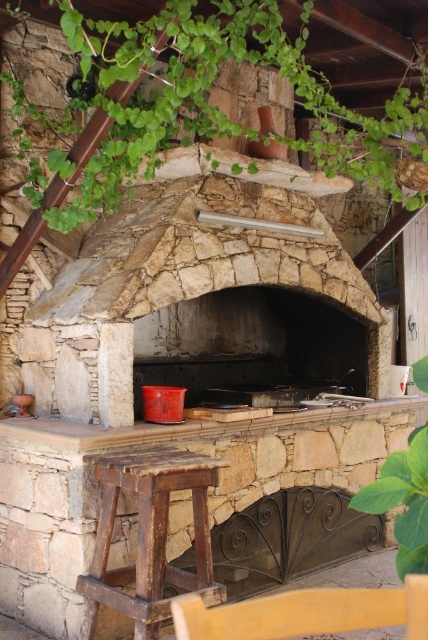
Question: Which object is closer to the camera taking this photo?

Choices:
 (A) green leafy plant at lower right
 (B) wooden chair at lower center
 (C) dark gray stone fireplace at center

Answer: (B)

Question: Can you confirm if natural stone fireplace at center is bigger than green leafy plant at upper center?

Choices:
 (A) yes
 (B) no

Answer: (B)

Question: Does dark gray stone fireplace at center have a smaller size compared to green leafy plant at lower right?

Choices:
 (A) no
 (B) yes

Answer: (A)

Question: Which point is closer to the camera taking this photo?

Choices:
 (A) (276, 378)
 (B) (172, 129)

Answer: (B)

Question: Which point is farther to the camera?

Choices:
 (A) (226, 609)
 (B) (133, 257)

Answer: (B)

Question: Does green leafy plant at upper center appear on the left side of dark gray stone fireplace at center?

Choices:
 (A) no
 (B) yes

Answer: (A)